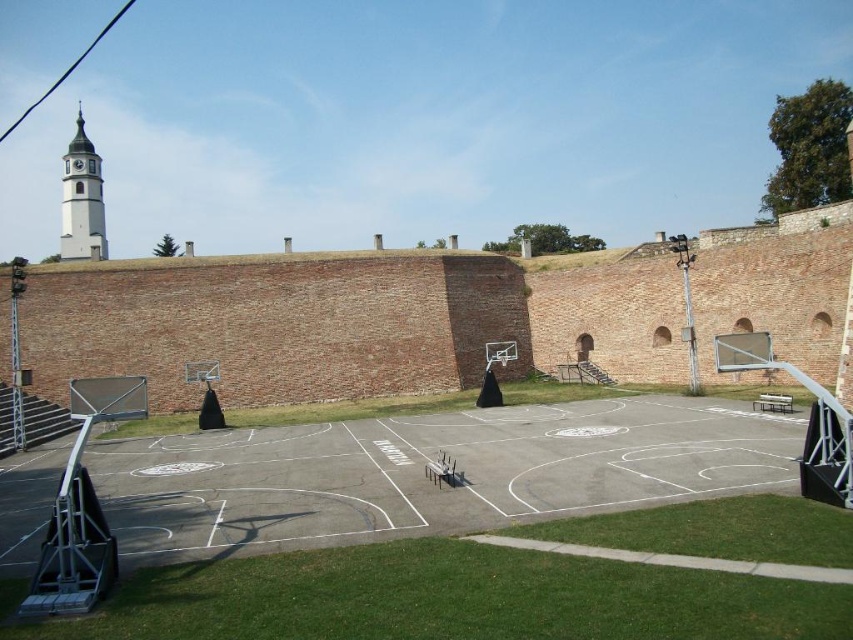
Question: Can you confirm if smooth concrete basketball court at center is positioned to the left of white stucco clock tower at upper left?

Choices:
 (A) yes
 (B) no

Answer: (B)

Question: Is smooth concrete basketball court at center further to camera compared to white stucco clock tower at upper left?

Choices:
 (A) yes
 (B) no

Answer: (B)

Question: Which of the following is the farthest from the observer?

Choices:
 (A) smooth concrete basketball court at center
 (B) white stucco clock tower at upper left

Answer: (B)

Question: Which object is closer to the camera taking this photo?

Choices:
 (A) smooth concrete basketball court at center
 (B) white stucco clock tower at upper left

Answer: (A)

Question: Is smooth concrete basketball court at center thinner than white stucco clock tower at upper left?

Choices:
 (A) yes
 (B) no

Answer: (A)